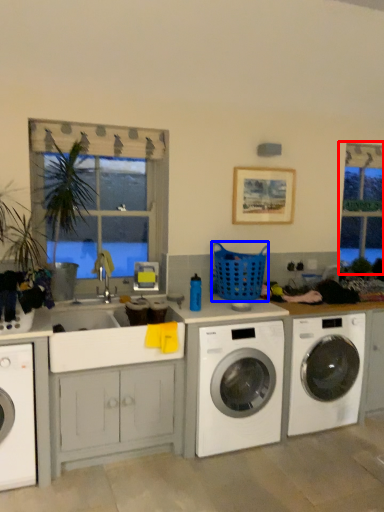
Question: Which object is closer to the camera taking this photo, bay window (highlighted by a red box) or basket (highlighted by a blue box)?

Choices:
 (A) bay window
 (B) basket

Answer: (B)